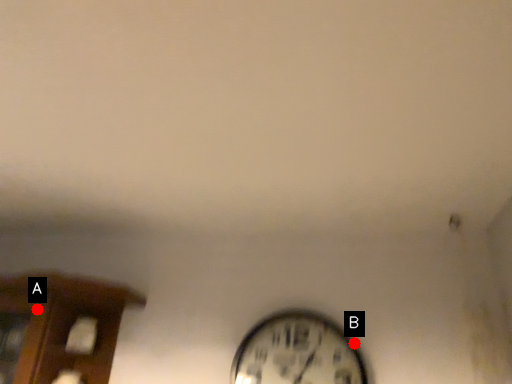
Question: Two points are circled on the image, labeled by A and B beside each circle. Which point is further to the camera?

Choices:
 (A) A is further
 (B) B is further

Answer: (B)